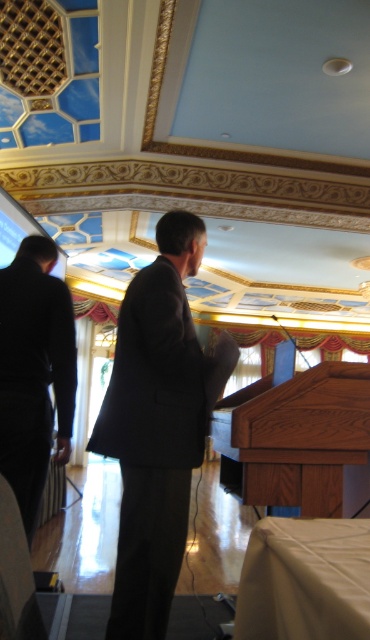
You are at the point marked by coordinates point (157,426). You want to move to the podium. Which direction should you go?

The dark gray suit at center is represented by point (157,426). Since the podium is in the foreground near the wooden podium with a dark finish, you should move forward to reach it.

You are organizing a presentation and need to place a 2.5 feet wide laptop on the brown wood podium at center. The black fabric suit at left is currently occupying space near the podium. Can the laptop fit on the podium if the suit is moved?

The brown wood podium at center might be wider than black fabric suit at left, so if the black fabric suit at left is moved, the laptop could potentially fit on the podium, but the exact width of the podium isn generated in the description.

You are a photographer at the event and want to capture a clear shot of the black fabric suit at left without the brown wood podium at center blocking the view. Is this possible based on their positions?

The black fabric suit at left is behind the brown wood podium at center, so the podium is blocking the view. To capture a clear shot of the black fabric suit at left, you would need to reposition yourself so that the podium is no longer between you and the suit.